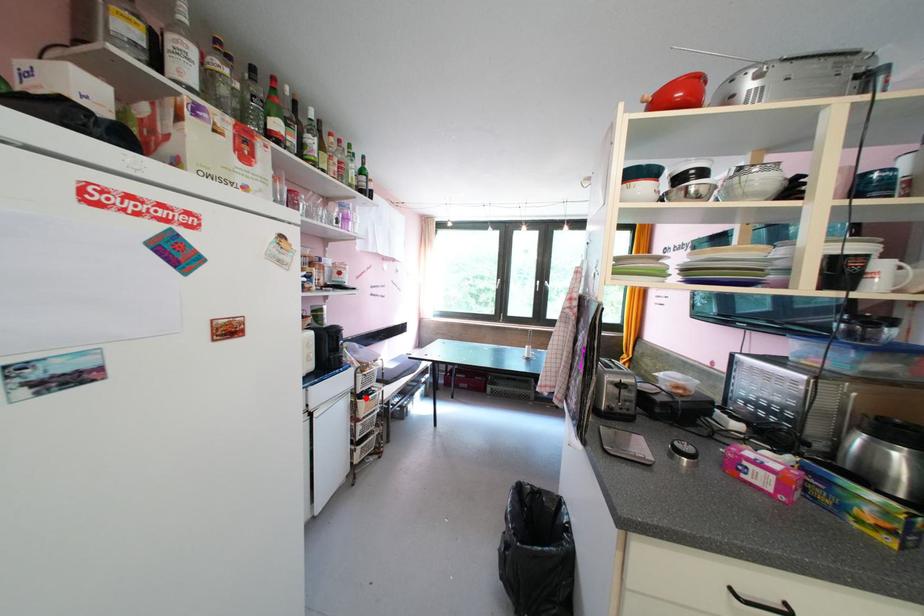
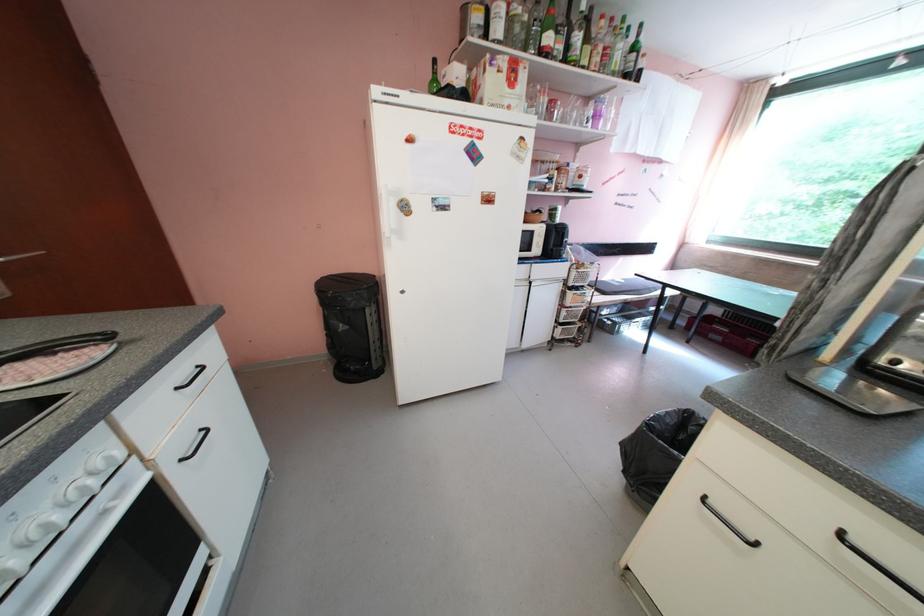
Question: I am providing you with two images of the same scene from different viewpoints. A red point is marked on the first image. Is the red point's position out of view in image 2?

Choices:
 (A) Yes
 (B) No

Answer: (B)